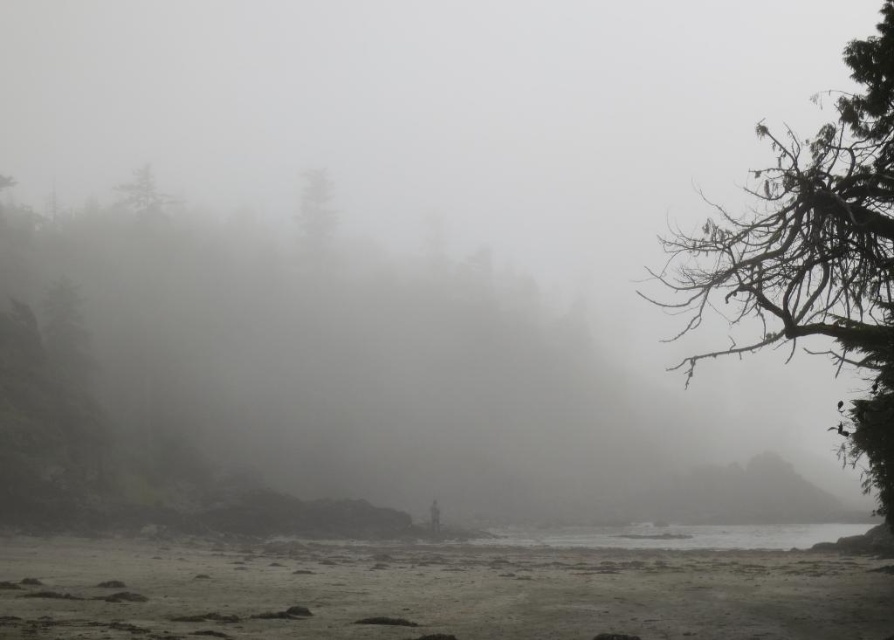
You are standing on the beach in this coastal scene and want to know which part is higher between the gray sand shoreline at lower center and the clear water at lower center. Can you determine this based on the description?

The gray sand shoreline at lower center is taller than the clear water at lower center, so the gray sand shoreline at lower center is higher.

You are a hiker trying to navigate through the misty coastal area. You notice two trees in the distance. The dark green textured tree at right and the green matte tree at center. Which tree appears wider from your current position?

The dark green textured tree at right appears wider than the green matte tree at center because its width surpasses the latter.

You are a hiker lost in the misty coastal area. You see a dark green textured tree at right and a green matte tree at center. Which tree is nearer to you?

The dark green textured tree at right is closer to the viewer than the green matte tree at center, so the dark green textured tree at right is nearer to you.